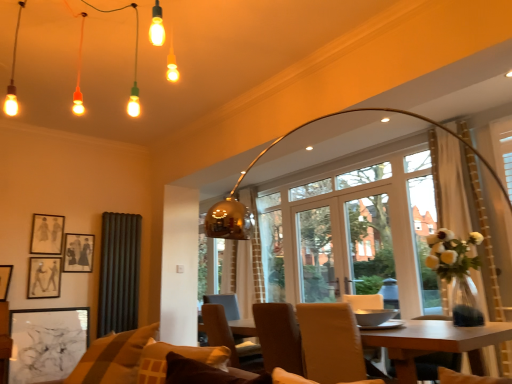
Identify the location of gold metallic curtain at center, the 2th curtain from the left. (244, 262).

The width and height of the screenshot is (512, 384). Describe the element at coordinates (78, 253) in the screenshot. I see `matte black picture frame at upper left, which is the second picture frame in top-to-bottom order` at that location.

The height and width of the screenshot is (384, 512). What do you see at coordinates (344, 247) in the screenshot? I see `transparent glass screen door at center` at bounding box center [344, 247].

This screenshot has height=384, width=512. Identify the location of black matte picture frame at lower left, the first picture frame in the bottom-to-top sequence. (47, 343).

From the image's perspective, is brown leather chair at center, positioned as the second chair in right-to-left order, located beneath transparent glass screen door at center?

Yes.

Which point is more forward, [237,363] or [392,302]?

The point [237,363] is more forward.

Could you tell me if brown leather chair at center, the second chair from the front, is turned towards transparent glass screen door at center?

Yes, brown leather chair at center, the second chair from the front, is facing transparent glass screen door at center.

Is dark gray fabric curtain at left, the second curtain viewed from the right, beside metallic gold chandelier at upper center?

dark gray fabric curtain at left, the second curtain viewed from the right, and metallic gold chandelier at upper center are not in contact.

Find the location of `curtain on the left of the metallic gold chandelier at upper center`. curtain on the left of the metallic gold chandelier at upper center is located at coordinates (119, 273).

Is dark gray fabric curtain at left, the second curtain in the back-to-front sequence, at the right side of metallic gold chandelier at upper center?

No, dark gray fabric curtain at left, the second curtain in the back-to-front sequence, is not to the right of metallic gold chandelier at upper center.

Considering the relative sizes of metallic gold chandelier at upper center and black matte picture frame at upper left, which appears as the second picture frame when ordered from the bottom, in the image provided, is metallic gold chandelier at upper center smaller than black matte picture frame at upper left, which appears as the second picture frame when ordered from the bottom,?

No.

Is there a large distance between metallic gold chandelier at upper center and black matte picture frame at upper left, which appears as the second picture frame when ordered from the bottom?

Indeed, metallic gold chandelier at upper center is not near black matte picture frame at upper left, which appears as the second picture frame when ordered from the bottom.

From a real-world perspective, who is located higher, metallic gold chandelier at upper center or black matte picture frame at upper left, arranged as the third picture frame when viewed from the top?

metallic gold chandelier at upper center is physically above.

How distant is metallic gold chandelier at upper center from black matte picture frame at upper left, which appears as the second picture frame when ordered from the bottom?

1.88 meters.

Could you tell me if brown leather chair at center, the first chair in the back-to-front sequence, is facing metallic gold chandelier at upper center?

No, brown leather chair at center, the first chair in the back-to-front sequence, is not oriented towards metallic gold chandelier at upper center.

Is brown leather chair at center, positioned as the second chair in right-to-left order, wider or thinner than metallic gold chandelier at upper center?

brown leather chair at center, positioned as the second chair in right-to-left order, is thinner than metallic gold chandelier at upper center.

From the image's perspective, which one is positioned lower, brown leather chair at center, the second chair from the front, or metallic gold chandelier at upper center?

brown leather chair at center, the second chair from the front, is shown below in the image.

Is brown leather chair at center, the first chair in the back-to-front sequence, situated inside metallic gold chandelier at upper center or outside?

brown leather chair at center, the first chair in the back-to-front sequence, is not inside metallic gold chandelier at upper center, it's outside.

Which of these two, black matte picture frame at upper left, which appears as the second picture frame when ordered from the bottom, or matte black picture frame at upper left, which is the second picture frame in top-to-bottom order, is bigger?

Bigger between the two is black matte picture frame at upper left, which appears as the second picture frame when ordered from the bottom.

From the image's perspective, is black matte picture frame at upper left, which appears as the second picture frame when ordered from the bottom, under matte black picture frame at upper left, which is counted as the third picture frame, starting from the bottom?

Yes, from the image's perspective, black matte picture frame at upper left, which appears as the second picture frame when ordered from the bottom, is beneath matte black picture frame at upper left, which is counted as the third picture frame, starting from the bottom.

In the scene shown: Is black matte picture frame at upper left, arranged as the third picture frame when viewed from the top, not near matte black picture frame at upper left, which is counted as the third picture frame, starting from the bottom?

No, black matte picture frame at upper left, arranged as the third picture frame when viewed from the top, is not far from matte black picture frame at upper left, which is counted as the third picture frame, starting from the bottom.

There is a matte black picture frame at upper left, which is the second picture frame in top-to-bottom order. Where is `the 1st picture frame below it (from a real-world perspective)`? This screenshot has height=384, width=512. the 1st picture frame below it (from a real-world perspective) is located at coordinates coord(44,277).

Which object is positioned more to the right, brown leather chair at center, which is counted as the first chair, starting from the left, or black matte picture frame at lower left, the first picture frame in the bottom-to-top sequence?

brown leather chair at center, which is counted as the first chair, starting from the left, is more to the right.

Considering the positions of objects brown leather chair at center, which is counted as the first chair, starting from the left, and black matte picture frame at lower left, the first picture frame in the bottom-to-top sequence, in the image provided, who is in front, brown leather chair at center, which is counted as the first chair, starting from the left, or black matte picture frame at lower left, the first picture frame in the bottom-to-top sequence,?

brown leather chair at center, which is counted as the first chair, starting from the left.

In the scene shown: How many degrees apart are the facing directions of brown leather chair at center, the second chair from the front, and black matte picture frame at lower left, acting as the 4th picture frame starting from the top?

79.8 degrees separate the facing orientations of brown leather chair at center, the second chair from the front, and black matte picture frame at lower left, acting as the 4th picture frame starting from the top.

Consider the image. Could you tell me if leather at center, marked as the second chair in a back-to-front arrangement, is turned towards gold metallic curtain at center, the 2th curtain viewed from the front?

No, leather at center, marked as the second chair in a back-to-front arrangement, is not oriented towards gold metallic curtain at center, the 2th curtain viewed from the front.

From a real-world perspective, between leather at center, marked as the second chair in a back-to-front arrangement, and gold metallic curtain at center, the 2th curtain from the left, who is vertically lower?

In real-world perspective, leather at center, marked as the second chair in a back-to-front arrangement, is lower.

Can we say leather at center, which is counted as the 2th chair, starting from the left, lies outside gold metallic curtain at center, the 2th curtain from the left?

Yes, leather at center, which is counted as the 2th chair, starting from the left, is outside of gold metallic curtain at center, the 2th curtain from the left.

Are leather at center, the 1th chair viewed from the right, and gold metallic curtain at center, placed as the 1th curtain when sorted from right to left, far apart?

Yes.

The height and width of the screenshot is (384, 512). I want to click on screen door located above the brown leather chair at center, the second chair from the front (from a real-world perspective), so click(344, 247).

Starting from the metallic gold chandelier at upper center, which curtain is the 1st one behind? Please provide its 2D coordinates.

[(119, 273)]

Which object lies further to the anchor point brown leather chair at center, the first chair in the back-to-front sequence, wooden table at center or black matte picture frame at upper left, which appears as the second picture frame when ordered from the bottom?

black matte picture frame at upper left, which appears as the second picture frame when ordered from the bottom, is positioned further to the anchor brown leather chair at center, the first chair in the back-to-front sequence.

Considering their positions, is wooden table at center positioned closer to brown leather chair at center, the first chair in the back-to-front sequence, than gold metallic curtain at center, the 2th curtain from the left?

wooden table at center is positioned closer to the anchor brown leather chair at center, the first chair in the back-to-front sequence.

Estimate the real-world distances between objects in this image. Which object is closer to black matte picture frame at lower left, acting as the 4th picture frame starting from the top, metallic gold chandelier at upper center or brown leather chair at center, the first chair in the back-to-front sequence?

Based on the image, brown leather chair at center, the first chair in the back-to-front sequence, appears to be nearer to black matte picture frame at lower left, acting as the 4th picture frame starting from the top.

Estimate the real-world distances between objects in this image. Which object is further from transparent glass screen door at center, dark gray fabric curtain at left, which is the 1th curtain from front to back, or black matte picture frame at lower left, acting as the 4th picture frame starting from the top?

Answer: The object further to transparent glass screen door at center is black matte picture frame at lower left, acting as the 4th picture frame starting from the top.

Which object lies nearer to the anchor point metallic gold chandelier at upper center, matte black picture frame at upper left, which is the second picture frame in top-to-bottom order, or gold metallic curtain at center, placed as the 1th curtain when sorted from right to left?

Based on the image, matte black picture frame at upper left, which is the second picture frame in top-to-bottom order, appears to be nearer to metallic gold chandelier at upper center.

Which object lies further to the anchor point brown leather chair at center, which is counted as the first chair, starting from the left, brown fabric couch at lower center or matte black picture frame at upper left, the 4th picture frame ordered from the bottom?

matte black picture frame at upper left, the 4th picture frame ordered from the bottom.

Consider the image. Estimate the real-world distances between objects in this image. Which object is further from metallic gold chandelier at upper center, black matte picture frame at lower left, the first picture frame in the bottom-to-top sequence, or wooden table at center?

wooden table at center is positioned further to the anchor metallic gold chandelier at upper center.

Considering their positions, is leather at center, which is counted as the 2th chair, starting from the left, positioned further to wooden table at center than matte black picture frame at upper left, the 4th picture frame ordered from the bottom?

matte black picture frame at upper left, the 4th picture frame ordered from the bottom.

Where is `kitchen & dining room table located between brown fabric couch at lower center and dark gray fabric curtain at left, which is the 1th curtain from front to back, in the depth direction`? The image size is (512, 384). kitchen & dining room table located between brown fabric couch at lower center and dark gray fabric curtain at left, which is the 1th curtain from front to back, in the depth direction is located at coordinates (436, 343).

Locate an element on the screen. The height and width of the screenshot is (384, 512). chandelier between brown fabric couch at lower center and black matte picture frame at upper left, arranged as the third picture frame when viewed from the top, in the front-back direction is located at coordinates (133, 62).

This screenshot has height=384, width=512. I want to click on chandelier located between brown fabric couch at lower center and gold metallic curtain at center, the first curtain viewed from the back, in the depth direction, so click(133, 62).

Identify the location of picture frame between black matte picture frame at lower left, the first picture frame in the bottom-to-top sequence, and transparent glass screen door at center, in the horizontal direction. (78, 253).